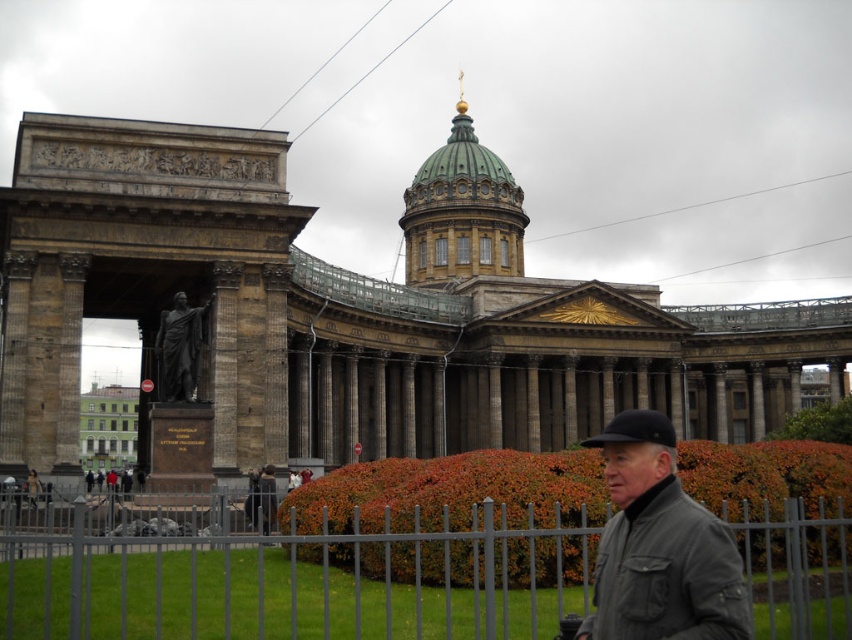
You are standing in front of the cathedral and want to take a photo that includes both the statue and the glass walkway. The statue is located at point (206, 180) and the glass walkway is at point (193, 316). Which point should you focus on first to ensure both are in focus?

You should focus on point (206, 180) first because it is closer to the camera than point (193, 316). This ensures that both points will be in focus when taking the photo.

You are an architect designing a new garden layout around the brown stone palace at center and the polished bronze statue at center. Since you need to know their relative sizes, which one is wider?

The brown stone palace at center is wider than the polished bronze statue at center.